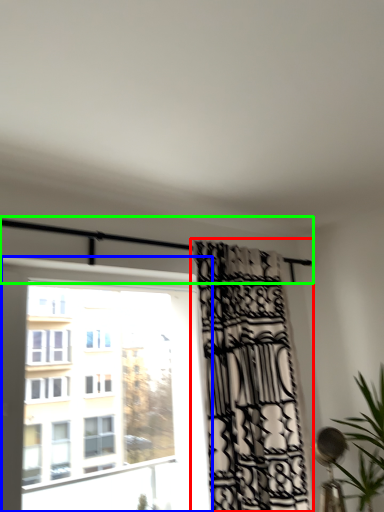
Question: Considering the real-world distances, which object is closest to curtain (highlighted by a red box)? window (highlighted by a blue box) or balcony (highlighted by a green box).

Choices:
 (A) window
 (B) balcony

Answer: (B)